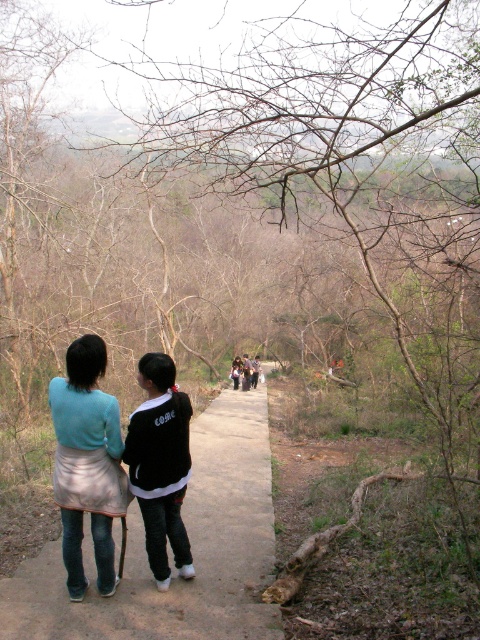
You are a photographer trying to capture both the light blue fabric skirt at center and the black cotton jacket at center in a single frame. Which clothing item will appear larger in your photo?

The light blue fabric skirt at center will appear larger in the photo because it is bigger than the black cotton jacket at center.

You are a delivery robot with a 1.5 meter long package. You are positioned on the brown concrete path at center and need to deliver the package to the black cotton jacket at center. Can you carry the package horizontally without it extending beyond your carrying area?

The distance between the brown concrete path at center and the black cotton jacket at center is 2.28 meters. Since the package is only 1.5 meters long, it will not extend beyond the carrying area when carried horizontally between them.